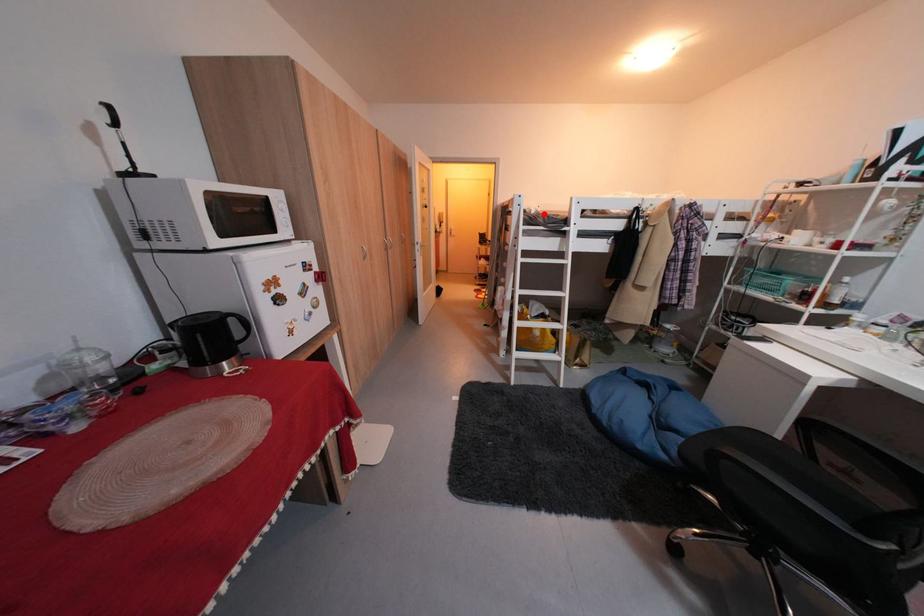
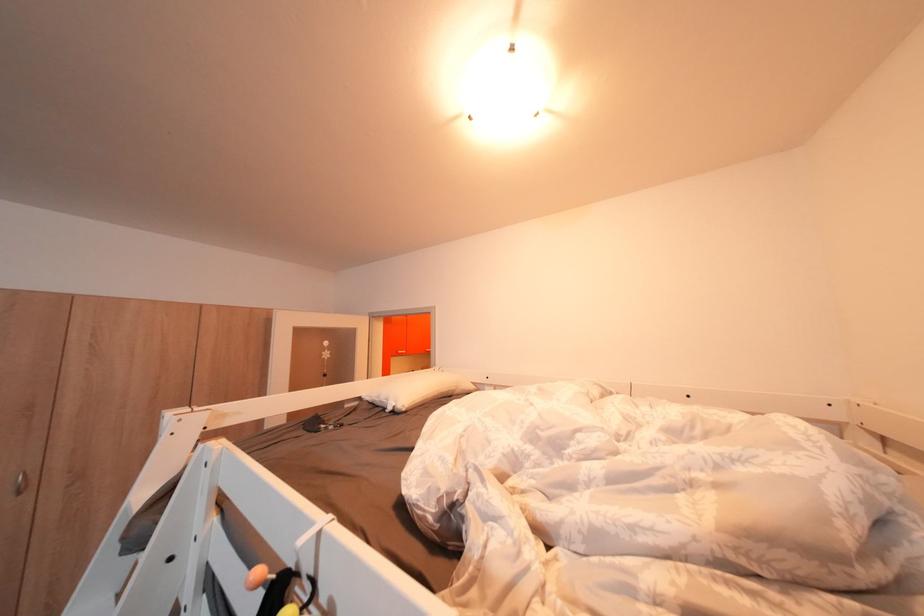
Question: I am providing you with two images of the same scene from different viewpoints. In image1, a red point is highlighted. Considering the same 3D point in image2, which of the following is correct?

Choices:
 (A) It is closer
 (B) It is farther

Answer: (B)